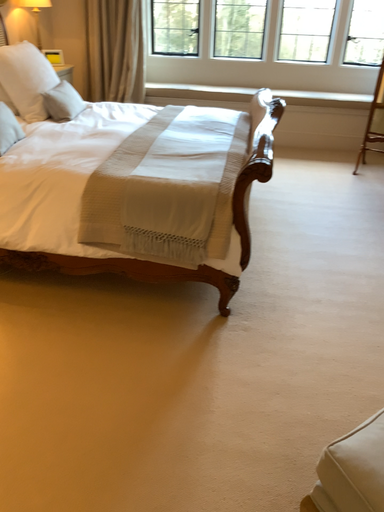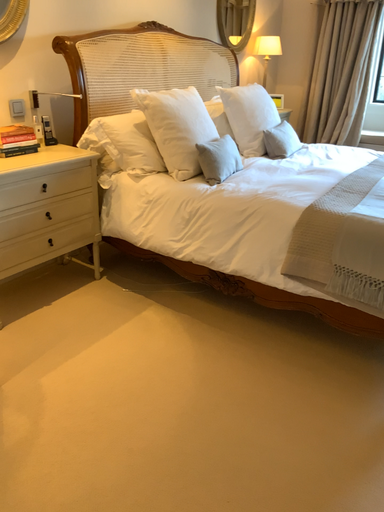
Question: Which way did the camera rotate in the video?

Choices:
 (A) rotated downward
 (B) rotated upward

Answer: (B)